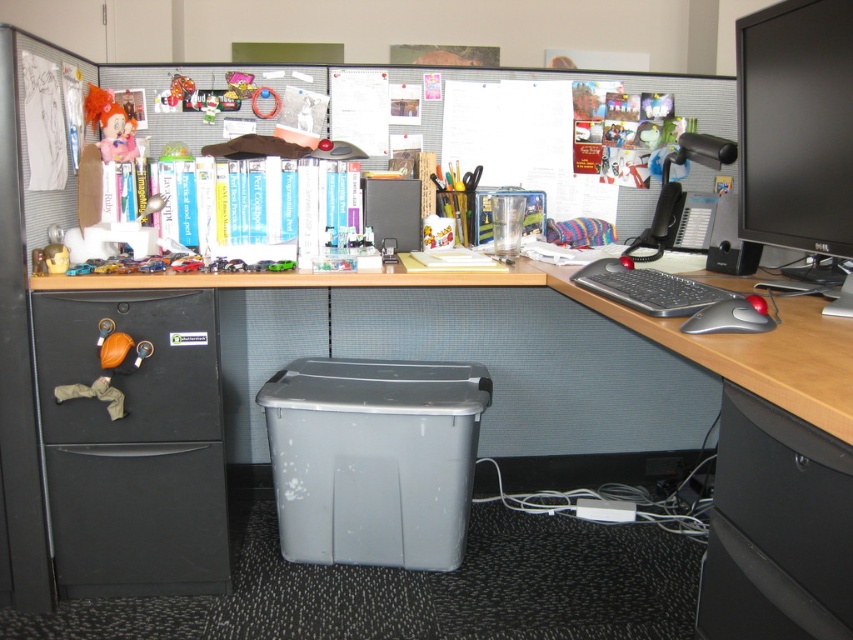
Question: Which point is closer to the camera?

Choices:
 (A) black glossy monitor at upper right
 (B) matte pink plush at upper left
 (C) black matte/file cabinet at left
 (D) black plastic drawer at lower right

Answer: (D)

Question: Can you confirm if black matte/file cabinet at left is bigger than silver/black plastic keyboard at right?

Choices:
 (A) yes
 (B) no

Answer: (A)

Question: Which object is closer to the camera taking this photo?

Choices:
 (A) rubberized black trackball at lower right
 (B) black matte/file cabinet at left

Answer: (A)

Question: Which of the following is the farthest from the observer?

Choices:
 (A) black glossy monitor at upper right
 (B) black matte drawer at lower left
 (C) black plastic drawer at lower right
 (D) rubberized black trackball at lower right

Answer: (B)

Question: Does black matte drawer at lower left have a greater width compared to gray plastic bin at lower center?

Choices:
 (A) yes
 (B) no

Answer: (B)

Question: Is black matte/file cabinet at left positioned in front of silver/black plastic keyboard at right?

Choices:
 (A) no
 (B) yes

Answer: (A)